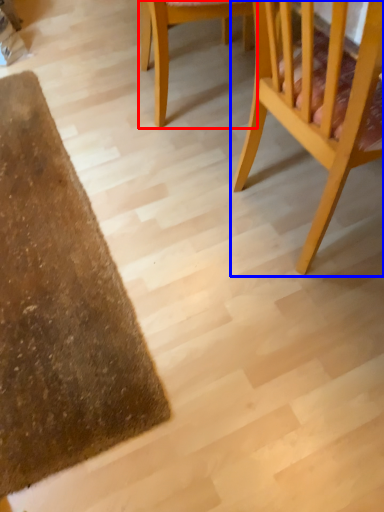
Question: Which point is closer to the camera, chair (highlighted by a red box) or chair (highlighted by a blue box)?

Choices:
 (A) chair
 (B) chair

Answer: (B)